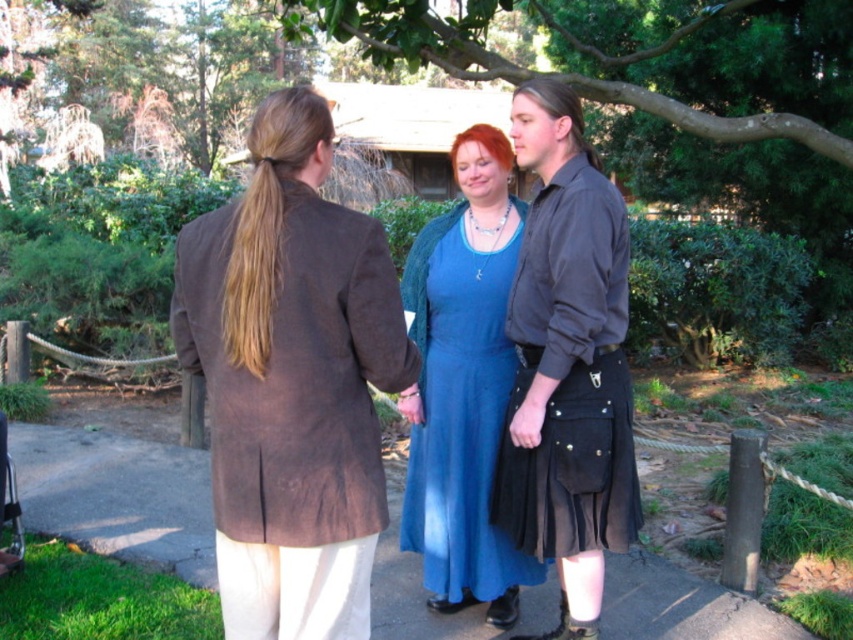
Who is more forward, (291, 232) or (636, 584)?

Point (291, 232) is in front.

Which is behind, point (280, 413) or point (24, 440)?

The point (24, 440) is behind.

Does point (218, 348) come closer to viewer compared to point (410, 604)?

Yes.

Identify the location of brown suede jacket at left. Image resolution: width=853 pixels, height=640 pixels. (291, 380).

Who is shorter, brown suede jacket at left or matte blue dress at center?

brown suede jacket at left

Which is more to the left, brown suede jacket at left or matte blue dress at center?

Positioned to the left is brown suede jacket at left.

Between point (318, 220) and point (430, 468), which one is positioned behind?

Positioned behind is point (430, 468).

This screenshot has height=640, width=853. Find the location of `brown suede jacket at left`. brown suede jacket at left is located at coordinates (291, 380).

Is black leather kilt at center below matte blue dress at center?

Actually, black leather kilt at center is above matte blue dress at center.

Does black leather kilt at center have a lesser width compared to matte blue dress at center?

Correct, black leather kilt at center's width is less than matte blue dress at center's.

Does point (578, 580) come in front of point (413, 264)?

That is True.

Find the location of `black leather kilt at center`. black leather kilt at center is located at coordinates (567, 364).